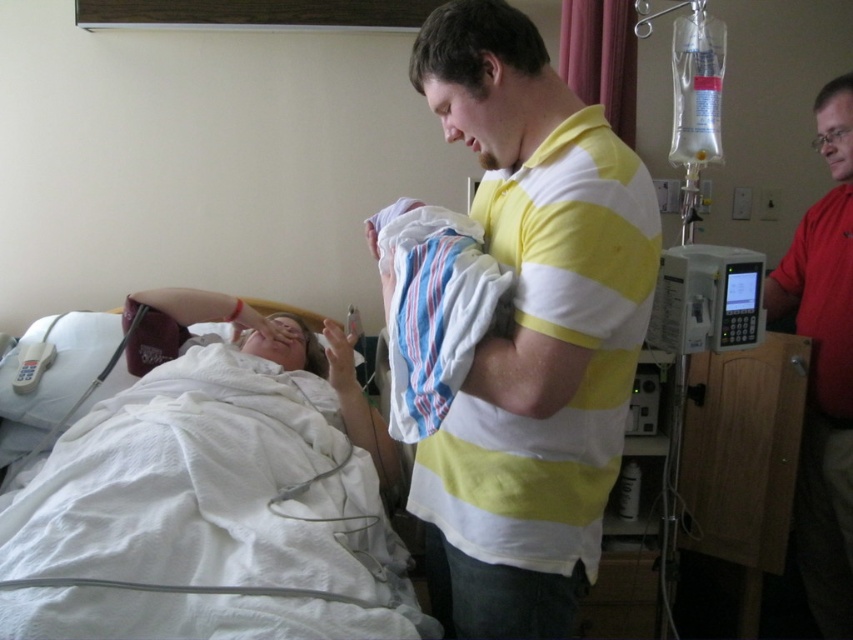
You are a nurse in this hospital scene. You need to place a small medical kit on the nearest object to the bed. Which object should you choose between the yellow striped shirt at center and the white fabric bed at upper left?

The white fabric bed at upper left is closer to the bed than the yellow striped shirt at center, so you should place the medical kit on the white fabric bed at upper left.

You are a nurse in the hospital. You need to determine which object is smaller between the yellow striped shirt at center and the white fabric bed at upper left. Which one is smaller?

The yellow striped shirt at center is smaller than the white fabric bed at upper left.

You are a medical professional in the hospital. You need to place a new medical device on the white fabric bed at upper left. What are the coordinates where you should place it?

The white fabric bed at upper left is located at coordinates point (212, 508).